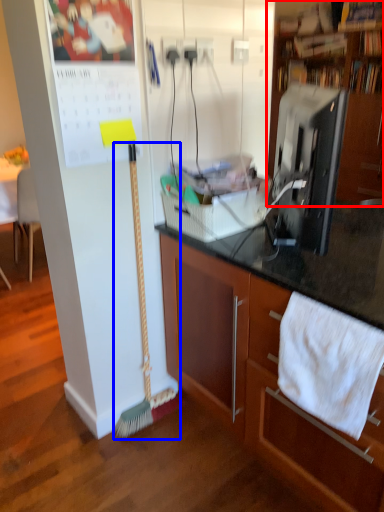
Question: Which point is closer to the camera, cabinetry (highlighted by a red box) or brush (highlighted by a blue box)?

Choices:
 (A) cabinetry
 (B) brush

Answer: (B)